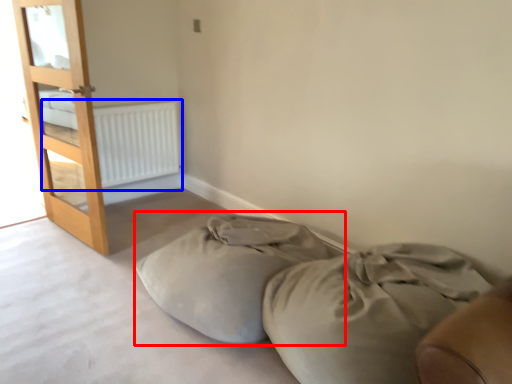
Question: Among these objects, which one is farthest to the camera, bean bag chair (highlighted by a red box) or radiator (highlighted by a blue box)?

Choices:
 (A) bean bag chair
 (B) radiator

Answer: (B)